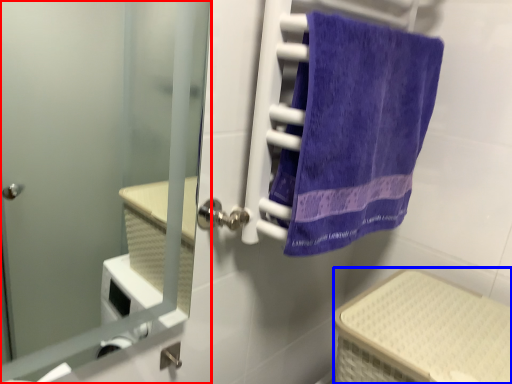
Question: Among these objects, which one is nearest to the camera, door (highlighted by a red box) or basket (highlighted by a blue box)?

Choices:
 (A) door
 (B) basket

Answer: (A)